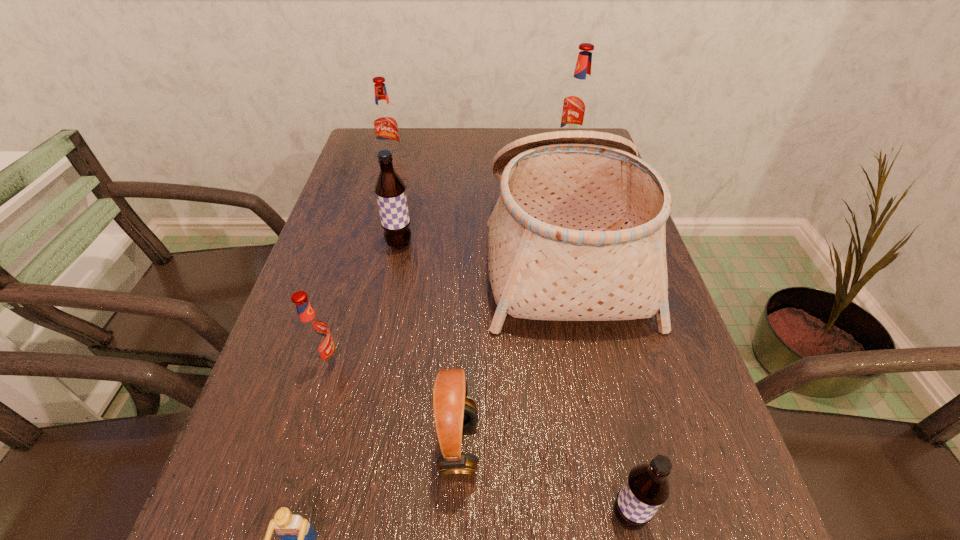
I want to click on the biggest red root beer, so point(578,99).

I want to click on the rightmost red root beer, so click(578, 99).

You are a GUI agent. You are given a task and a screenshot of the screen. Output one action in this format:
    pyautogui.click(x=<x>, y=<y>)
    Task: Click on the basket
    Image resolution: width=960 pixels, height=540 pixels.
    Given the screenshot: What is the action you would take?
    pyautogui.click(x=578, y=233)

Find the location of a particular element. The width and height of the screenshot is (960, 540). the second smallest red root beer is located at coordinates (385, 123).

The width and height of the screenshot is (960, 540). In order to click on the bigger brown root beer in this screenshot , I will do `click(390, 190)`.

The height and width of the screenshot is (540, 960). Identify the location of the left brown root beer. (390, 190).

In order to click on the smallest red root beer in this screenshot , I will do `click(313, 332)`.

In order to click on the nearest red root beer in this screenshot , I will do `click(313, 332)`.

This screenshot has width=960, height=540. Identify the location of the nearer brown root beer. (646, 488).

The height and width of the screenshot is (540, 960). I want to click on the nearest root beer, so (x=646, y=488).